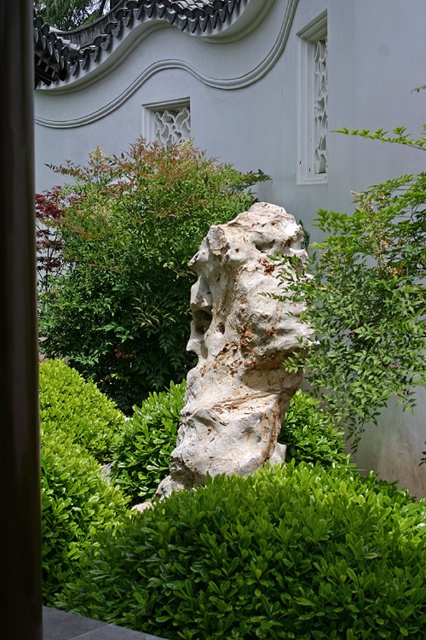
Question: Considering the real-world distances, which object is closest to the smooth brown pole at left?

Choices:
 (A) green leafy hedge at center
 (B) white rough stone at center
 (C) white stone sculpture at center

Answer: (C)

Question: Can you confirm if white stone sculpture at center is positioned to the left of smooth brown pole at left?

Choices:
 (A) no
 (B) yes

Answer: (A)

Question: Observing the image, what is the correct spatial positioning of green leafy hedge at center in reference to white stone sculpture at center?

Choices:
 (A) left
 (B) right

Answer: (A)

Question: Which object appears farthest from the camera in this image?

Choices:
 (A) smooth brown pole at left
 (B) green leafy hedge at center
 (C) white stone sculpture at center

Answer: (B)

Question: Can you confirm if white stone sculpture at center is smaller than smooth brown pole at left?

Choices:
 (A) no
 (B) yes

Answer: (A)

Question: Estimate the real-world distances between objects in this image. Which object is farther from the smooth brown pole at left?

Choices:
 (A) white stone sculpture at center
 (B) white rough stone at center

Answer: (B)